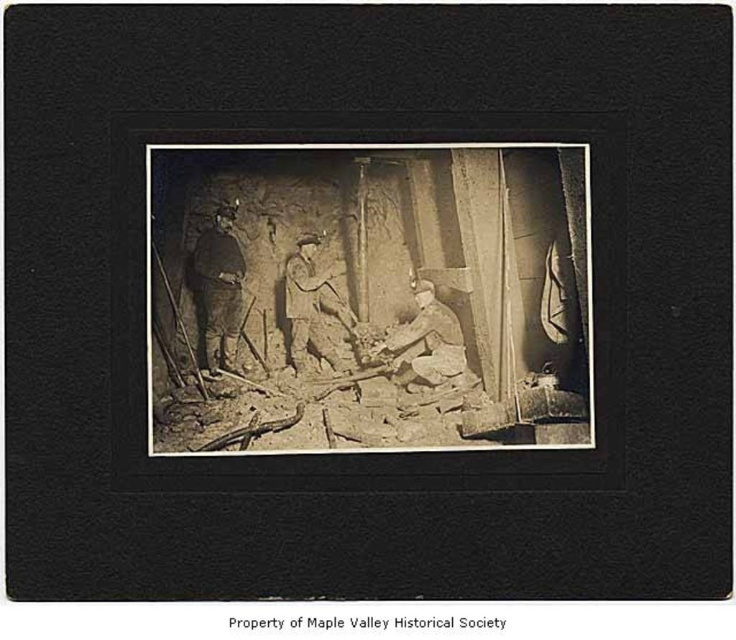
Question: Can you confirm if dark brown leather jacket at center is positioned above light brown leather jacket at lower right?

Choices:
 (A) no
 (B) yes

Answer: (B)

Question: Which object is positioned closest to the sepia-toned wood frame at center?

Choices:
 (A) light brown leather jacket at lower right
 (B) dark brown leather jacket at center

Answer: (A)

Question: Which point is farther to the camera?

Choices:
 (A) (406, 353)
 (B) (314, 378)
 (C) (194, 253)

Answer: (A)

Question: Which point is closer to the camera taking this photo?

Choices:
 (A) (417, 378)
 (B) (252, 387)

Answer: (B)

Question: Is dark brown leather jacket at center positioned before light brown leather jacket at lower right?

Choices:
 (A) no
 (B) yes

Answer: (B)

Question: Can you confirm if sepia-toned wood frame at center is positioned to the left of dark brown leather jacket at center?

Choices:
 (A) yes
 (B) no

Answer: (B)